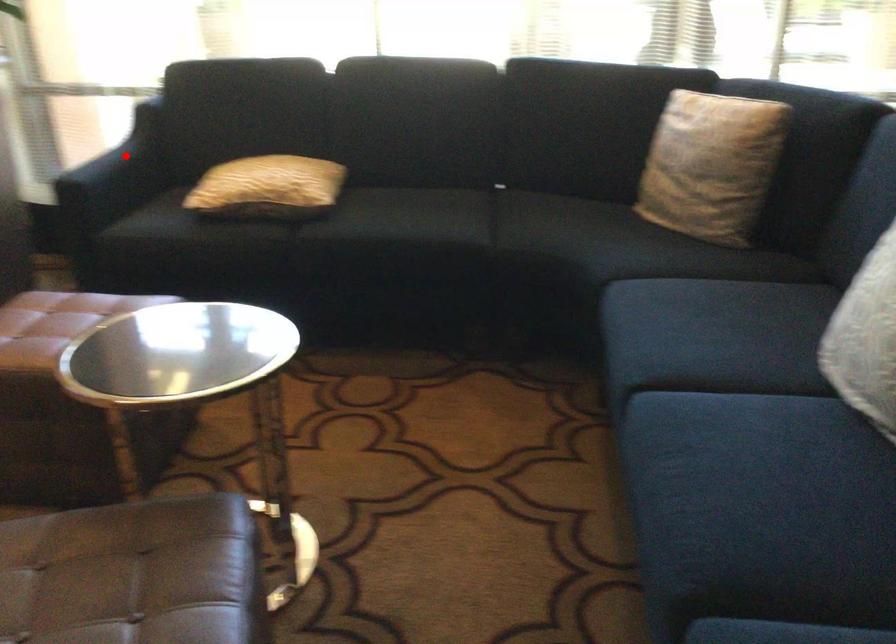
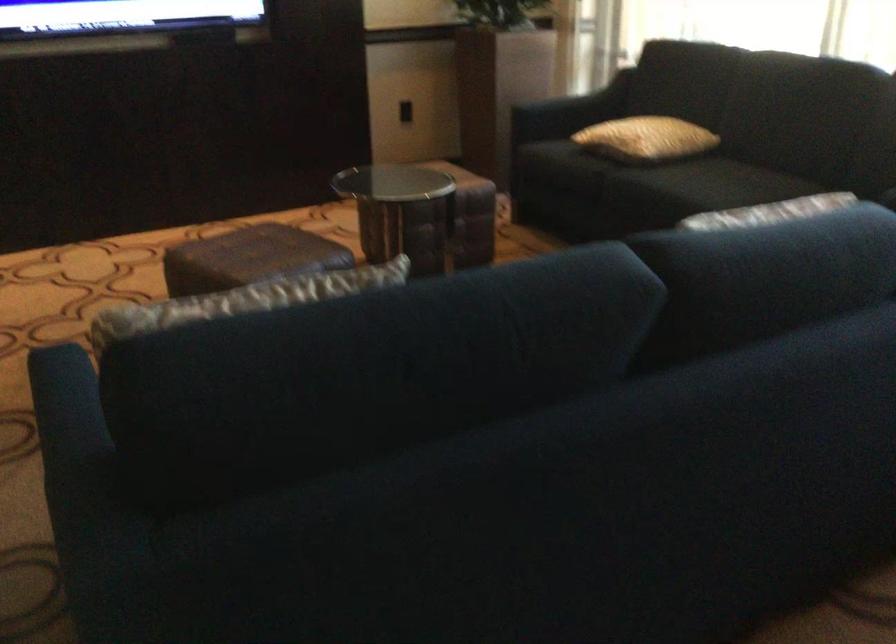
In the second image, find the point that corresponds to the highlighted location in the first image.

(586, 99)